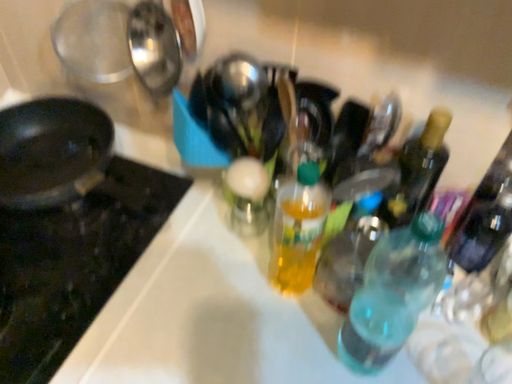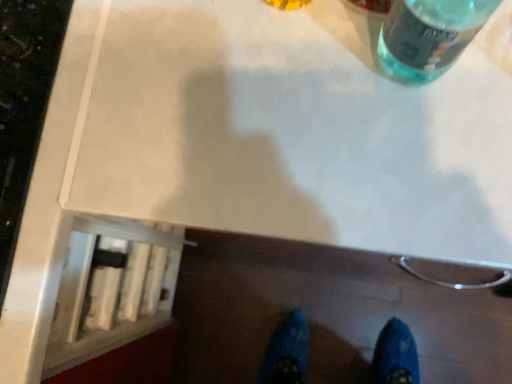
Question: Which way did the camera rotate in the video?

Choices:
 (A) rotated downward
 (B) rotated upward

Answer: (A)